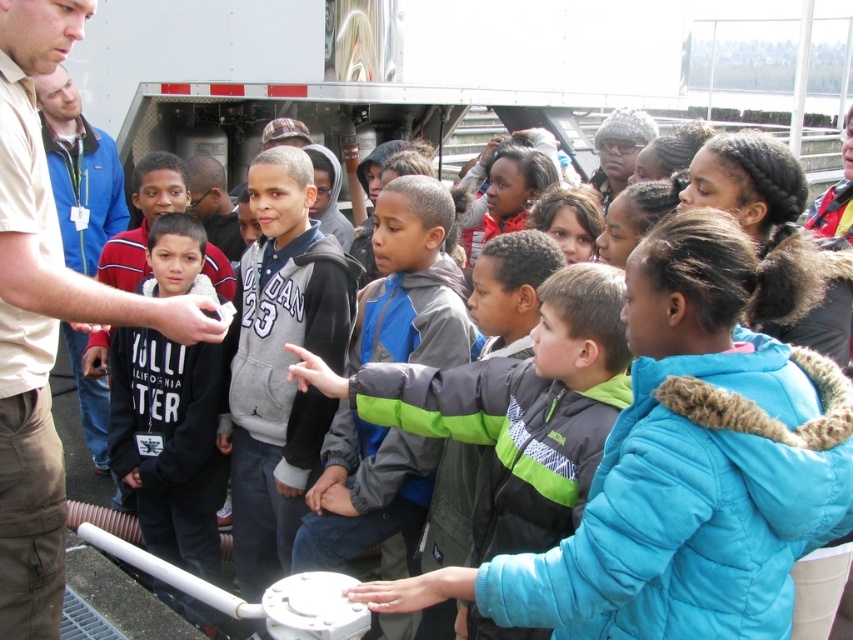
Question: Observing the image, what is the correct spatial positioning of beige cotton shirt at upper left in reference to gray-green fleece jacket at center?

Choices:
 (A) left
 (B) right

Answer: (A)

Question: Among these objects, which one is nearest to the camera?

Choices:
 (A) beige cotton shirt at upper left
 (B) black fleece jacket at center

Answer: (A)

Question: Does blue fuzzy jacket at center have a smaller size compared to gray-green fleece jacket at center?

Choices:
 (A) no
 (B) yes

Answer: (A)

Question: Which object is farther from the camera taking this photo?

Choices:
 (A) black fleece jacket at center
 (B) blue fuzzy jacket at center
 (C) beige cotton shirt at upper left

Answer: (A)

Question: Which object appears farthest from the camera in this image?

Choices:
 (A) blue jacket at left
 (B) black fleece jacket at center

Answer: (A)

Question: Considering the relative positions of blue fuzzy jacket at center and beige cotton shirt at upper left in the image provided, where is blue fuzzy jacket at center located with respect to beige cotton shirt at upper left?

Choices:
 (A) right
 (B) left

Answer: (A)